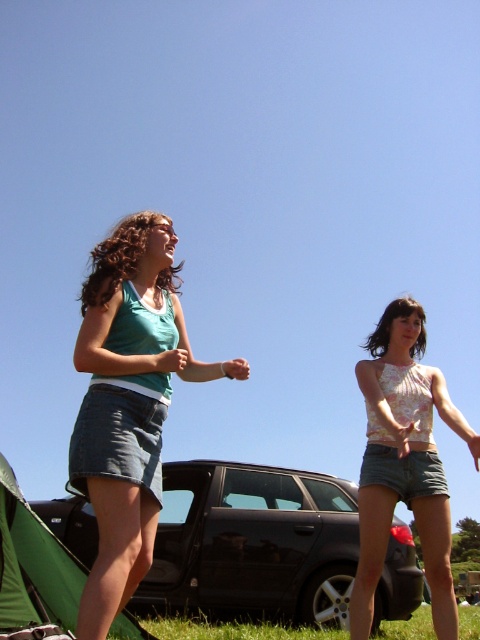
Is point (250, 566) in front of point (31, 547)?

No, (250, 566) is further to viewer.

Is black metallic car at center shorter than green fabric tent at lower left?

Incorrect, black metallic car at center's height does not fall short of green fabric tent at lower left's.

Is point (204, 476) positioned in front of point (62, 564)?

No, (204, 476) is behind (62, 564).

At what (x,y) coordinates should I click in order to perform the action: click on black metallic car at center. Please return your answer as a coordinate pair (x, y). Image resolution: width=480 pixels, height=640 pixels. Looking at the image, I should click on (252, 545).

Is black metallic car at center below green grass at lower center?

No, black metallic car at center is not below green grass at lower center.

Can you confirm if black metallic car at center is shorter than green grass at lower center?

In fact, black metallic car at center may be taller than green grass at lower center.

Between point (333, 621) and point (228, 632), which one is positioned behind?

The point (333, 621) is behind.

This screenshot has height=640, width=480. What are the coordinates of `black metallic car at center` in the screenshot? It's located at (252, 545).

Can you confirm if green fabric tent at lower left is positioned to the right of green grass at lower center?

In fact, green fabric tent at lower left is to the left of green grass at lower center.

In the scene shown: Can you confirm if green fabric tent at lower left is taller than green grass at lower center?

Yes.

Describe the element at coordinates (34, 570) in the screenshot. I see `green fabric tent at lower left` at that location.

I want to click on green fabric tent at lower left, so click(34, 570).